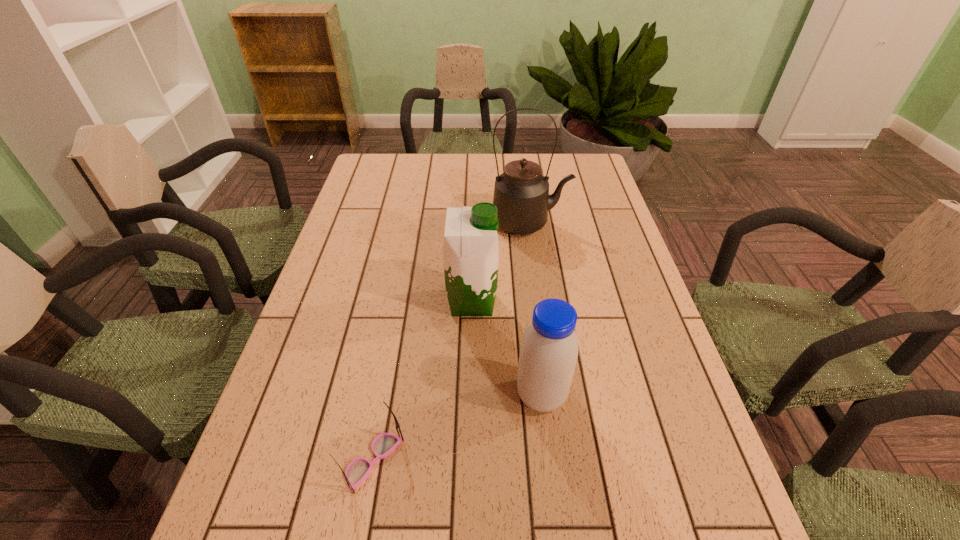
What are the coordinates of `free spot that satisfies the following two spatial constraints: 1. spout on the tallest object; 2. on the front side of the second nearest object` in the screenshot? It's located at 554,396.

Identify the location of vacant area that satisfies the following two spatial constraints: 1. on the front-facing side of the left soya milk; 2. on the front side of the leftmost object. (468, 460).

You are a GUI agent. You are given a task and a screenshot of the screen. Output one action in this format:
    pyautogui.click(x=<x>, y=<y>)
    Task: Click on the vacant space that satisfies the following two spatial constraints: 1. on the front-facing side of the second farthest object; 2. on the front side of the leftmost object
    
    Given the screenshot: What is the action you would take?
    pyautogui.click(x=468, y=460)

Where is `free spot that satisfies the following two spatial constraints: 1. spout on the kettle; 2. on the front side of the third farthest object`? This screenshot has width=960, height=540. free spot that satisfies the following two spatial constraints: 1. spout on the kettle; 2. on the front side of the third farthest object is located at coordinates (554, 396).